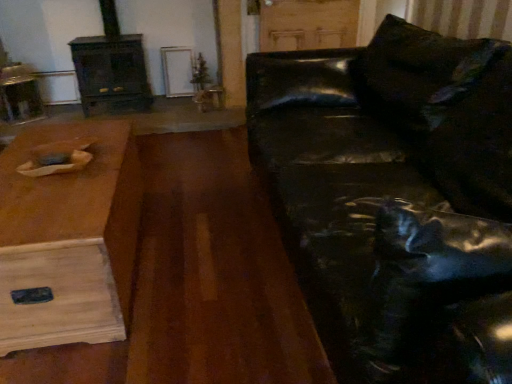
Question: Is wooden table at left beside dark wood fireplace at left?

Choices:
 (A) no
 (B) yes

Answer: (A)

Question: Is wooden table at left not near dark wood fireplace at left?

Choices:
 (A) yes
 (B) no

Answer: (A)

Question: Does wooden table at left have a lesser width compared to dark wood fireplace at left?

Choices:
 (A) no
 (B) yes

Answer: (A)

Question: Is wooden table at left at the left side of dark wood fireplace at left?

Choices:
 (A) yes
 (B) no

Answer: (B)

Question: Can you confirm if wooden table at left is wider than dark wood fireplace at left?

Choices:
 (A) no
 (B) yes

Answer: (B)

Question: From the image's perspective, is wooden table at left under dark wood fireplace at left?

Choices:
 (A) yes
 (B) no

Answer: (A)

Question: Does wooden table at left appear on the left side of shiny black leather couch at right?

Choices:
 (A) no
 (B) yes

Answer: (B)

Question: Is wooden table at left behind shiny black leather couch at right?

Choices:
 (A) yes
 (B) no

Answer: (A)

Question: Can you confirm if wooden table at left is taller than shiny black leather couch at right?

Choices:
 (A) no
 (B) yes

Answer: (A)

Question: Is wooden table at left facing away from shiny black leather couch at right?

Choices:
 (A) no
 (B) yes

Answer: (B)

Question: Would you consider wooden table at left to be distant from shiny black leather couch at right?

Choices:
 (A) yes
 (B) no

Answer: (B)

Question: Is the surface of wooden table at left in direct contact with shiny black leather couch at right?

Choices:
 (A) no
 (B) yes

Answer: (A)

Question: From a real-world perspective, is dark wood fireplace at left under shiny black leather couch at right?

Choices:
 (A) yes
 (B) no

Answer: (B)